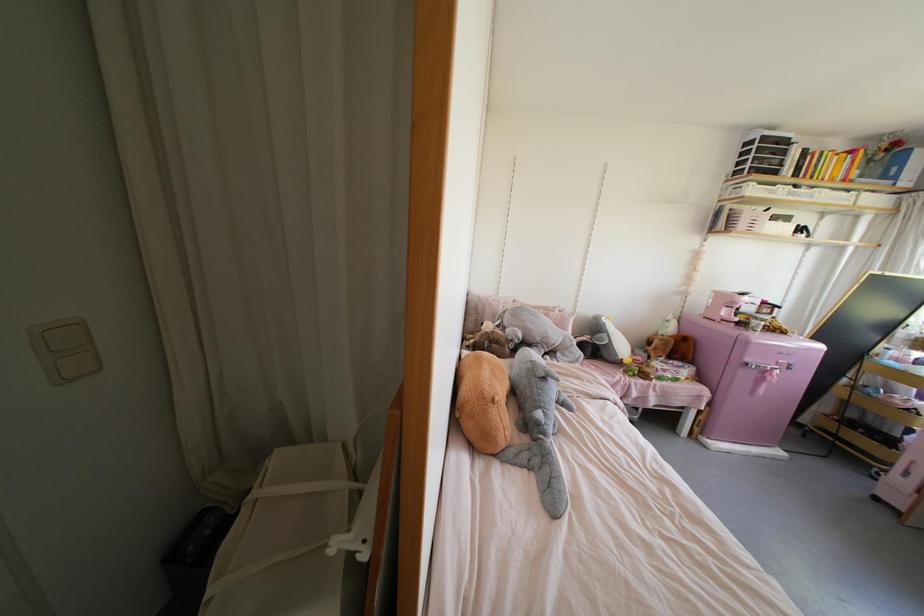
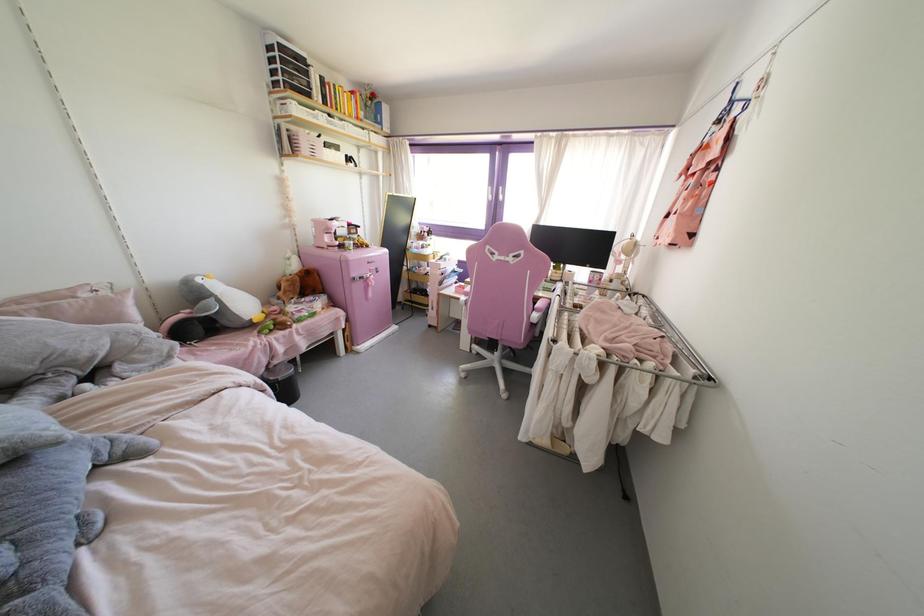
Where in the second image is the point corresponding to point (779, 223) from the first image?

(333, 151)